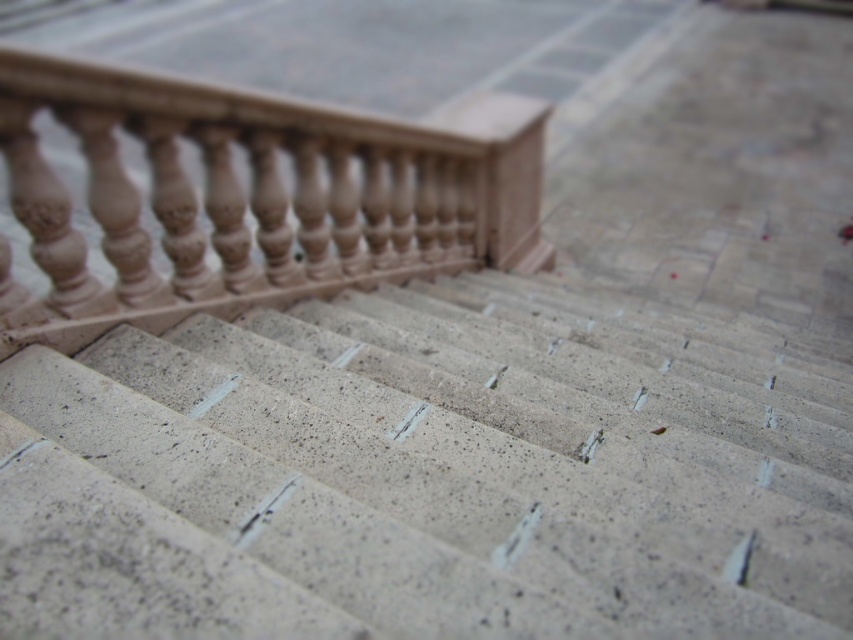
Between point (372, 332) and point (242, 259), which one is positioned behind?

Positioned behind is point (242, 259).

Does granite stairs at center appear on the right side of sandy beige stone balustrade at upper left?

Yes, granite stairs at center is to the right of sandy beige stone balustrade at upper left.

I want to click on granite stairs at center, so click(x=432, y=472).